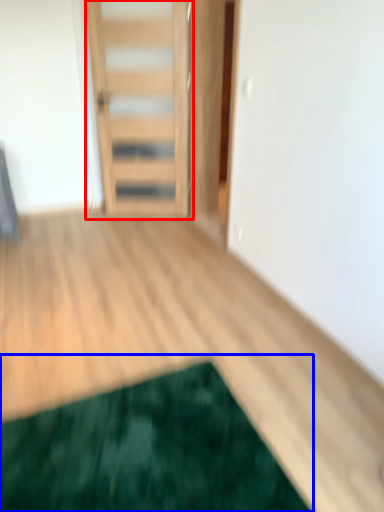
Question: Which object appears farthest to the camera in this image, door (highlighted by a red box) or mat (highlighted by a blue box)?

Choices:
 (A) door
 (B) mat

Answer: (A)